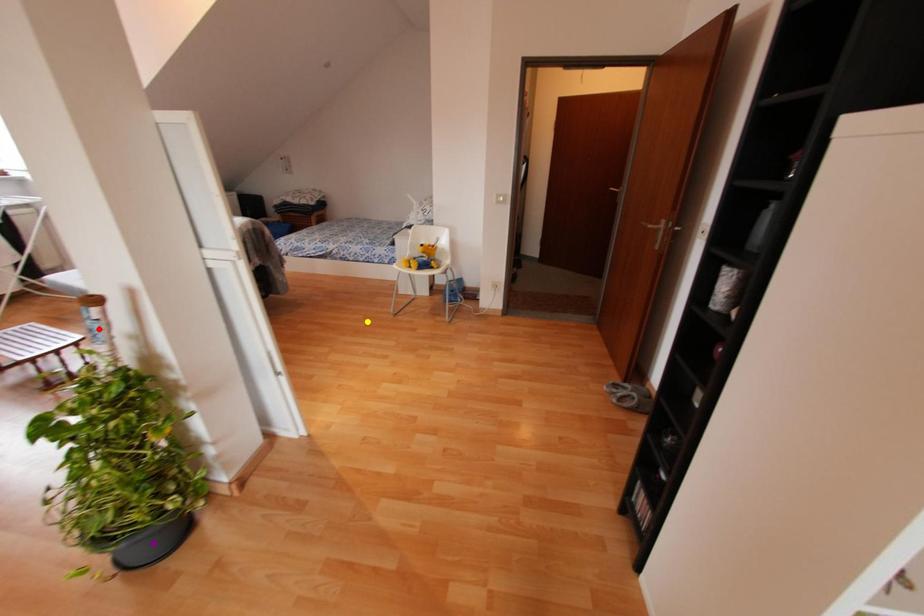
Order these from nearest to farthest:
red point, purple point, yellow point

purple point < red point < yellow point